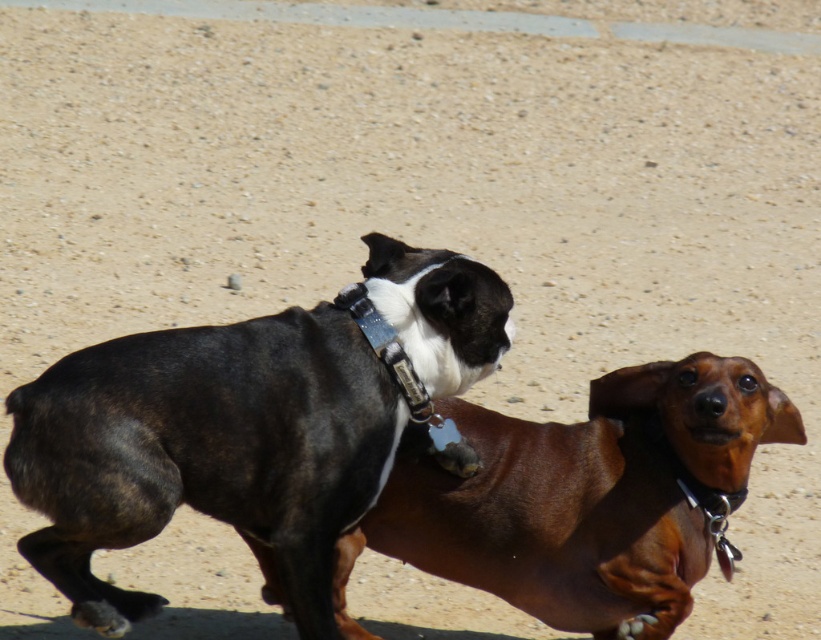
Which is behind, point (132, 384) or point (652, 428)?

Positioned behind is point (652, 428).

Which is behind, point (62, 435) or point (745, 404)?

Positioned behind is point (745, 404).

Where is `black leather dog at center`? Image resolution: width=821 pixels, height=640 pixels. black leather dog at center is located at coordinates (205, 451).